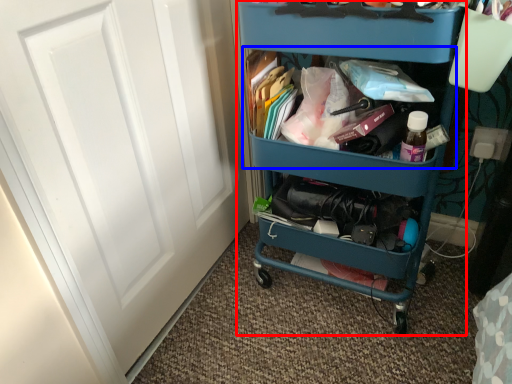
Question: Which object appears farthest to the camera in this image, furniture (highlighted by a red box) or cabinet (highlighted by a blue box)?

Choices:
 (A) furniture
 (B) cabinet

Answer: (B)